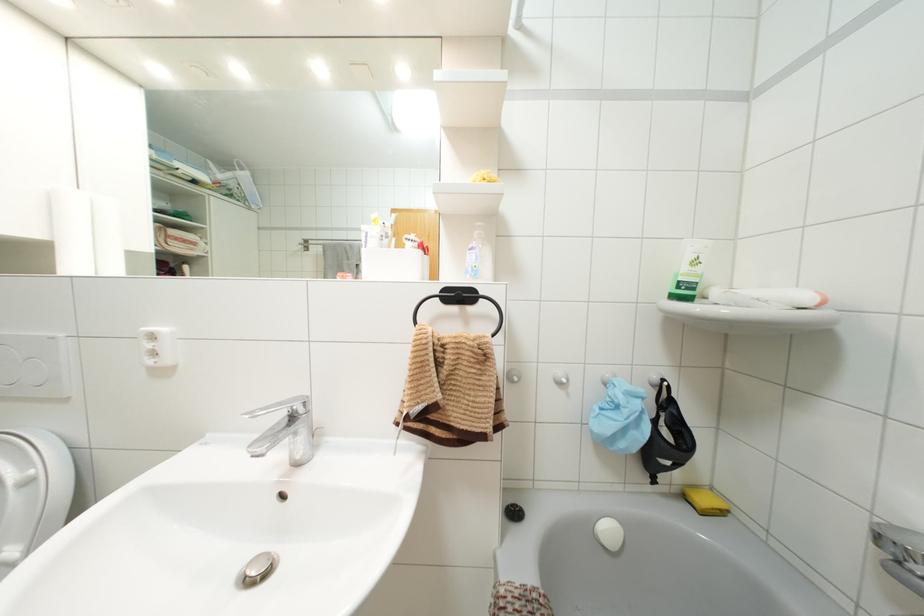
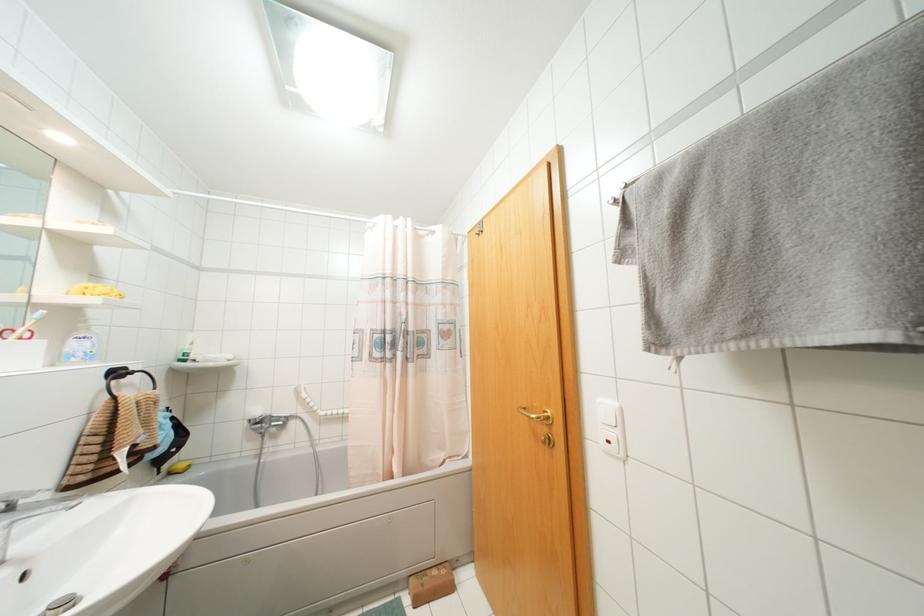
Locate, in the second image, the point that corresponds to point 685,496 in the first image.

(169, 472)